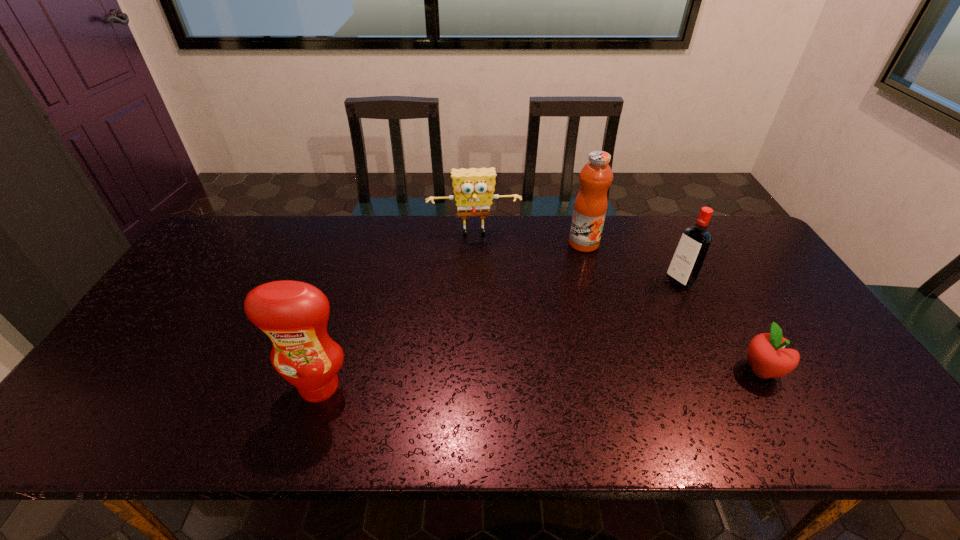
Where is `free point between the fourth object from right to left and the vodka`? This screenshot has height=540, width=960. free point between the fourth object from right to left and the vodka is located at coordinates (577, 257).

Locate an element on the screen. blank region between the fourth object from left to right and the rightmost object is located at coordinates (721, 326).

The image size is (960, 540). Identify the location of blank region between the rightmost object and the second object from left to right. (618, 302).

Where is `free space between the fourth object from left to right and the sponge`? The height and width of the screenshot is (540, 960). free space between the fourth object from left to right and the sponge is located at coordinates (577, 257).

Where is `vacant area that lies between the sponge and the vodka`? This screenshot has height=540, width=960. vacant area that lies between the sponge and the vodka is located at coordinates (577, 257).

I want to click on empty space between the third nearest object and the condiment, so click(x=499, y=334).

Where is `free space between the fourth object from right to left and the fruit juice`? Image resolution: width=960 pixels, height=540 pixels. free space between the fourth object from right to left and the fruit juice is located at coordinates (529, 238).

Point out which object is positioned as the second nearest to the fruit juice. Please provide its 2D coordinates. Your answer should be formatted as a tuple, i.e. [(x, y)], where the tuple contains the x and y coordinates of a point satisfying the conditions above.

[(690, 253)]

Where is `object that is the third nearest to the vodka`? The height and width of the screenshot is (540, 960). object that is the third nearest to the vodka is located at coordinates (473, 188).

Find the location of a particular element. Image resolution: width=960 pixels, height=540 pixels. free region that satisfies the following two spatial constraints: 1. on the front side of the second object from right to left; 2. on the side where a bite is taken out of the apple is located at coordinates (724, 370).